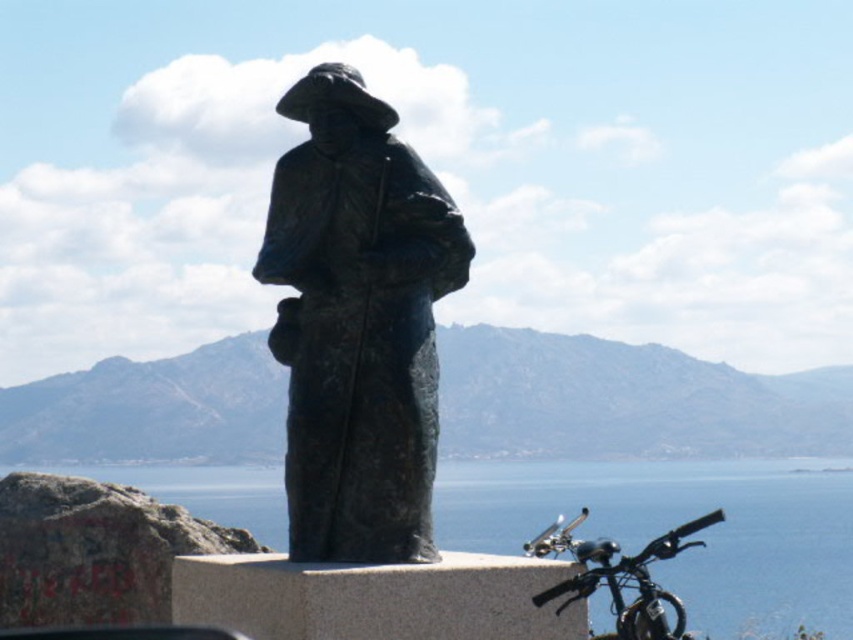
You are a tour guide leading a group near the bronze statue. You want to point out the blue water at lower right and the shiny black bicycle at lower right. Can you tell the group how far apart these two landmarks are?

The distance between the blue water at lower right and the shiny black bicycle at lower right is 39.55 feet.

You are standing at the origin point of the image coordinate system. The bronze statue at center is located at point (357, 323). If you want to walk directly to the bronze statue at center, in which direction should you move relative to the image?

Since the bronze statue at center is located at point (357, 323), you should move towards the center of the image to reach it.